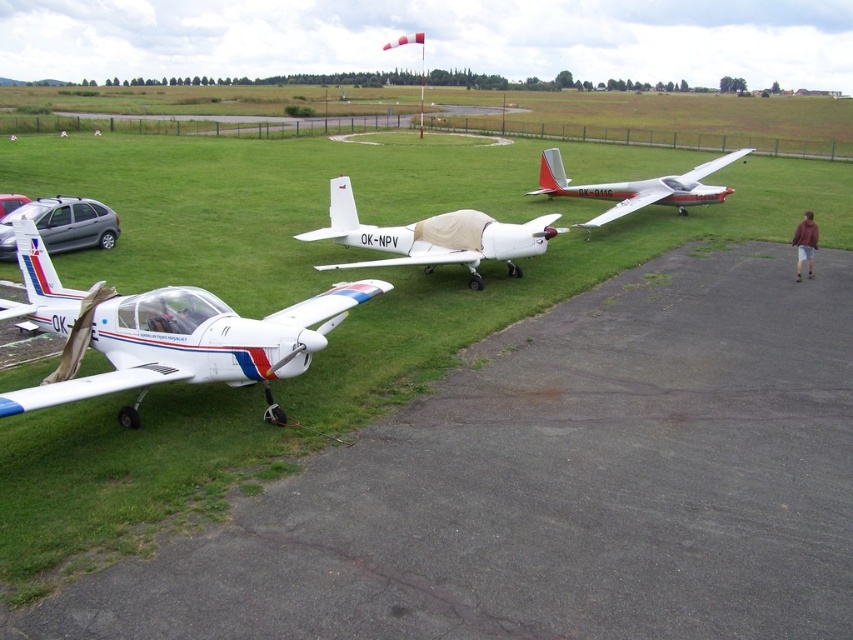
You are a pilot standing at the edge of the airfield. You need to move the white matte airplane at center to the runway, but there is a silver metallic hatchback at left blocking the way. Can you move the airplane as it is, or do you need to move the hatchback first?

The white matte airplane at center is positioned under the silver metallic hatchback at left, meaning the hatchback is blocking the path. You need to move the silver metallic hatchback at left first before moving the airplane.

You are standing at the edge of the airfield and see the white matte glider at center and the silver metallic hatchback at left. Which object is positioned higher from the ground?

A: The white matte glider at center is above the silver metallic hatchback at left, so it is positioned higher from the ground.

Please provide the 2D coordinates of the white matte glider at center in the image coordinate system where the origin is at the bottom left corner of the image. The coordinates should be in the format of a tuple with two decimal numbers rounded to three decimal places.

The 2D coordinates of the white matte glider at center are at point (636, 188).